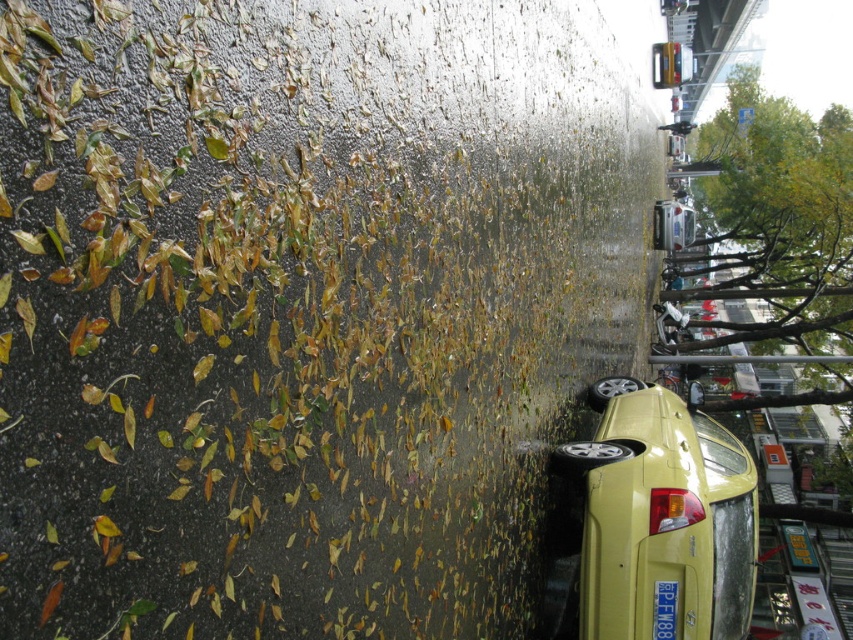
Find the location of a particular element. yellow matte car at lower right is located at coordinates (663, 516).

Does yellow matte car at lower right have a larger size compared to yellow plastic license plate at lower right?

Yes.

Image resolution: width=853 pixels, height=640 pixels. In order to click on yellow matte car at lower right in this screenshot , I will do `click(663, 516)`.